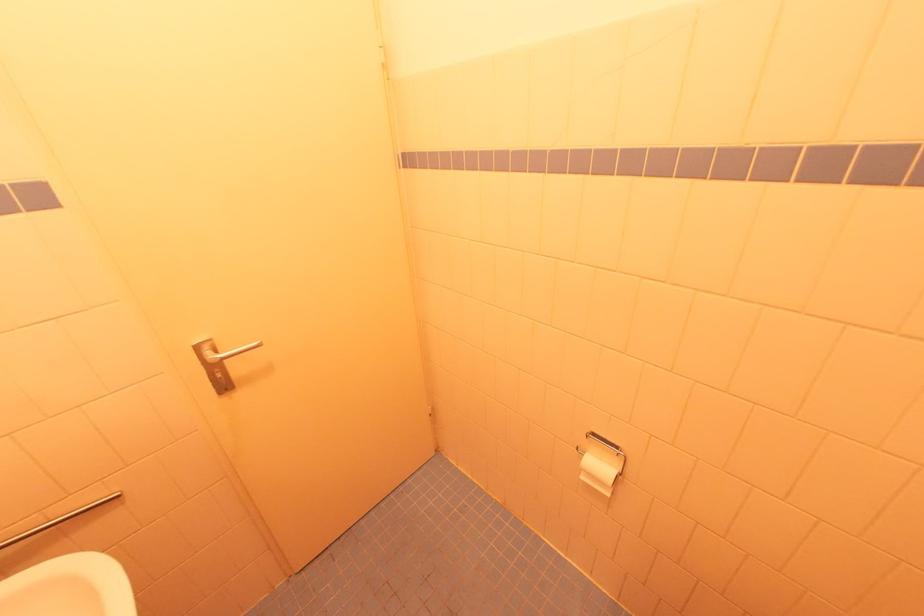
The height and width of the screenshot is (616, 924). Find the location of `metal towel rack`. metal towel rack is located at coordinates (58, 520).